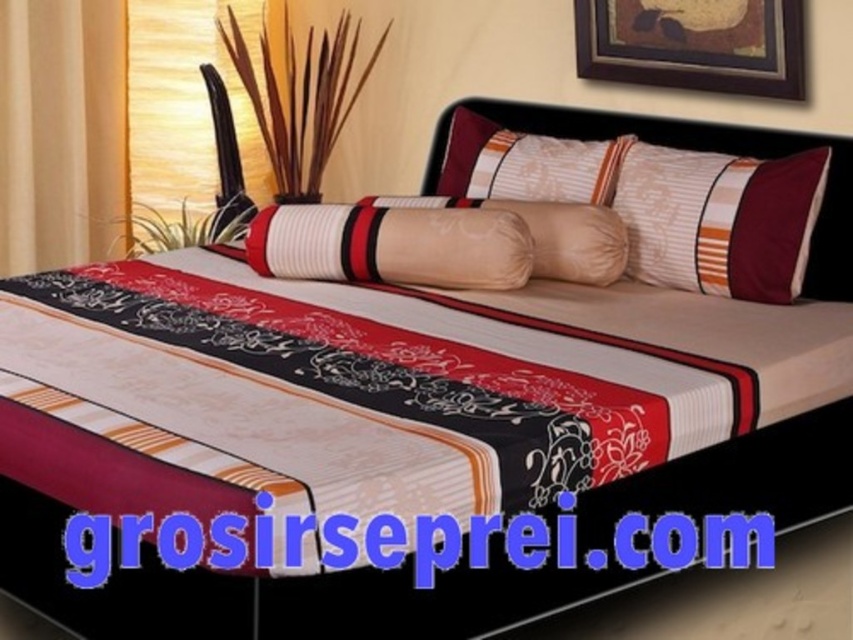
Between point (387, 221) and point (460, 115), which one is positioned in front?

Point (387, 221)

Does beige fabric pillow at center have a lesser height compared to striped fabric pillow at center?

Indeed, beige fabric pillow at center has a lesser height compared to striped fabric pillow at center.

Locate an element on the screen. beige fabric pillow at center is located at coordinates (502, 244).

What do you see at coordinates (720, 220) in the screenshot? The height and width of the screenshot is (640, 853). I see `striped fabric pillow at upper right` at bounding box center [720, 220].

Looking at this image, measure the distance from striped fabric pillow at upper right to matte white pillow at center.

striped fabric pillow at upper right is 38.25 inches from matte white pillow at center.

In order to click on striped fabric pillow at upper right in this screenshot , I will do `click(720, 220)`.

Is matte white pillow at center wider than silky fabric headboard at center?

In fact, matte white pillow at center might be narrower than silky fabric headboard at center.

Which is behind, point (260, 241) or point (543, 132)?

Point (543, 132)

Between point (491, 253) and point (722, 138), which one is positioned behind?

The point (722, 138) is behind.

Identify the location of matte white pillow at center. Image resolution: width=853 pixels, height=640 pixels. (392, 244).